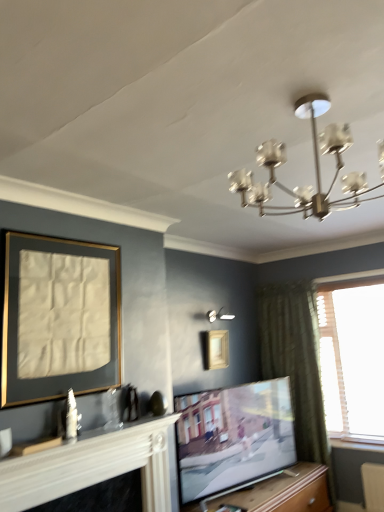
I want to click on matte black tv at center, so click(233, 437).

What do you see at coordinates (217, 349) in the screenshot?
I see `wooden picture frame at upper center, positioned as the 2th picture frame in top-to-bottom order` at bounding box center [217, 349].

Describe the element at coordinates (92, 466) in the screenshot. I see `white painted wood fireplace at lower left` at that location.

Identify the location of white glossy wall sconce at upper center. (218, 315).

Is matte black tv at center next to wooden at center?

No, matte black tv at center is not with wooden at center.

Consider the image. Is matte black tv at center located outside wooden at center?

Yes.

Can you confirm if matte black tv at center is taller than wooden at center?

Indeed, matte black tv at center has a greater height compared to wooden at center.

Which object is positioned more to the right, matte black tv at center or wooden at center?

wooden at center is more to the right.

In terms of width, does matte black tv at center look wider or thinner when compared to white painted wood fireplace at lower left?

Considering their sizes, matte black tv at center looks broader than white painted wood fireplace at lower left.

From a real-world perspective, is matte black tv at center beneath white painted wood fireplace at lower left?

Yes.

Which is behind, point (240, 397) or point (152, 467)?

The point (240, 397) is farther from the camera.

How distant is white painted wood fireplace at lower left from white glossy wall sconce at upper center?

white painted wood fireplace at lower left is 5.70 feet from white glossy wall sconce at upper center.

Is white painted wood fireplace at lower left facing away from white glossy wall sconce at upper center?

white painted wood fireplace at lower left is not turned away from white glossy wall sconce at upper center.

Does white painted wood fireplace at lower left have a greater height compared to white glossy wall sconce at upper center?

Indeed, white painted wood fireplace at lower left has a greater height compared to white glossy wall sconce at upper center.

Is white painted wood fireplace at lower left directly adjacent to white glossy wall sconce at upper center?

They are not placed beside each other.

Considering the sizes of objects matte black tv at center and wooden picture frame at upper center, positioned as the 2th picture frame in top-to-bottom order, in the image provided, who is taller, matte black tv at center or wooden picture frame at upper center, positioned as the 2th picture frame in top-to-bottom order,?

matte black tv at center.

The image size is (384, 512). Find the location of `television in front of the wooden picture frame at upper center, which is the second picture frame in front-to-back order`. television in front of the wooden picture frame at upper center, which is the second picture frame in front-to-back order is located at coordinates (233, 437).

Consider the image. Can you tell me how much matte black tv at center and wooden picture frame at upper center, positioned as the 2th picture frame in top-to-bottom order, differ in facing direction?

9.48 degrees.

Is matte black tv at center positioned beyond the bounds of wooden picture frame at upper center, the first picture frame when ordered from back to front?

That's correct, matte black tv at center is outside of wooden picture frame at upper center, the first picture frame when ordered from back to front.

Is wooden at center bigger than matte black tv at center?

Correct, wooden at center is larger in size than matte black tv at center.

Which is behind, point (280, 482) or point (227, 487)?

Point (280, 482)

Which object is positioned more to the left, wooden at center or matte black tv at center?

Positioned to the left is matte black tv at center.

Locate an element on the screen. television that appears above the wooden at center (from the image's perspective) is located at coordinates (233, 437).

Does point (225, 315) lie in front of point (207, 346)?

No, (225, 315) is behind (207, 346).

In the scene shown: Is white glossy wall sconce at upper center to the left of wooden picture frame at upper center, positioned as the 2th picture frame in top-to-bottom order, from the viewer's perspective?

Incorrect, white glossy wall sconce at upper center is not on the left side of wooden picture frame at upper center, positioned as the 2th picture frame in top-to-bottom order.

Does white glossy wall sconce at upper center have a larger size compared to wooden picture frame at upper center, which is the second picture frame in left-to-right order?

Actually, white glossy wall sconce at upper center might be smaller than wooden picture frame at upper center, which is the second picture frame in left-to-right order.

The height and width of the screenshot is (512, 384). Find the location of `lamp located above the wooden picture frame at upper center, positioned as the 2th picture frame in top-to-bottom order (from a real-world perspective)`. lamp located above the wooden picture frame at upper center, positioned as the 2th picture frame in top-to-bottom order (from a real-world perspective) is located at coordinates (218, 315).

Based on the photo, from a real-world perspective, is white glossy wall sconce at upper center beneath wooden at center?

Incorrect, from a real-world perspective, white glossy wall sconce at upper center is higher than wooden at center.

In terms of size, does white glossy wall sconce at upper center appear bigger or smaller than wooden at center?

Considering their sizes, white glossy wall sconce at upper center takes up less space than wooden at center.

From the image's perspective, between white glossy wall sconce at upper center and wooden at center, who is located below?

wooden at center.

Does white glossy wall sconce at upper center touch wooden at center?

They are not placed beside each other.

Find the location of a particular element. television to the left of wooden at center is located at coordinates (233, 437).

Find the location of a particular element. Image resolution: width=384 pixels, height=512 pixels. television below the white painted wood fireplace at lower left (from a real-world perspective) is located at coordinates (233, 437).

Estimate the real-world distances between objects in this image. Which object is further from matte black tv at center, wooden picture frame at upper center, which is the second picture frame in left-to-right order, or white painted wood fireplace at lower left?

white painted wood fireplace at lower left is further to matte black tv at center.

Looking at the image, which one is located closer to white painted wood fireplace at lower left, wooden picture frame at upper center, arranged as the first picture frame when ordered from the bottom, or white glossy wall sconce at upper center?

wooden picture frame at upper center, arranged as the first picture frame when ordered from the bottom.

From the image, which object appears to be farther from matte gold picture frame at left, acting as the second picture frame starting from the bottom, wooden picture frame at upper center, positioned as the 2th picture frame in top-to-bottom order, or wooden at center?

wooden at center is further to matte gold picture frame at left, acting as the second picture frame starting from the bottom.

Based on their spatial positions, is wooden at center or wooden picture frame at upper center, positioned as the 2th picture frame in top-to-bottom order, closer to matte gold picture frame at left, positioned as the second picture frame in back-to-front order?

wooden picture frame at upper center, positioned as the 2th picture frame in top-to-bottom order.

Estimate the real-world distances between objects in this image. Which object is further from matte gold picture frame at left, acting as the second picture frame starting from the bottom, white painted wood fireplace at lower left or wooden picture frame at upper center, placed as the 1th picture frame when sorted from right to left?

wooden picture frame at upper center, placed as the 1th picture frame when sorted from right to left, is positioned further to the anchor matte gold picture frame at left, acting as the second picture frame starting from the bottom.

Based on the photo, which object lies nearer to the anchor point matte black tv at center, matte gold picture frame at left, which is counted as the 2th picture frame, starting from the right, or wooden picture frame at upper center, the first picture frame when ordered from back to front?

The object closer to matte black tv at center is wooden picture frame at upper center, the first picture frame when ordered from back to front.

Consider the image. When comparing their distances from matte black tv at center, does white painted wood fireplace at lower left or wooden at center seem further?

Among the two, white painted wood fireplace at lower left is located further to matte black tv at center.

Considering their positions, is matte black tv at center positioned further to wooden picture frame at upper center, the first picture frame when ordered from back to front, than matte gold picture frame at left, positioned as the first picture frame in left-to-right order?

Among the two, matte gold picture frame at left, positioned as the first picture frame in left-to-right order, is located further to wooden picture frame at upper center, the first picture frame when ordered from back to front.

Find the location of a particular element. The height and width of the screenshot is (512, 384). picture frame between white glossy wall sconce at upper center and wooden at center vertically is located at coordinates (217, 349).

The height and width of the screenshot is (512, 384). What are the coordinates of `television that lies between white glossy wall sconce at upper center and wooden at center from top to bottom` in the screenshot? It's located at (233, 437).

This screenshot has width=384, height=512. Find the location of `fireplace between matte gold picture frame at left, arranged as the first picture frame when viewed from the front, and matte black tv at center from top to bottom`. fireplace between matte gold picture frame at left, arranged as the first picture frame when viewed from the front, and matte black tv at center from top to bottom is located at coordinates (92, 466).

In order to click on television between wooden picture frame at upper center, which is the second picture frame in left-to-right order, and wooden at center from top to bottom in this screenshot , I will do `click(233, 437)`.